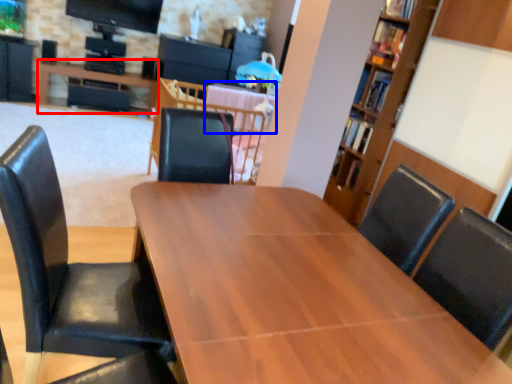
Question: Which of the following is the farthest to the observer, table (highlighted by a red box) or table (highlighted by a blue box)?

Choices:
 (A) table
 (B) table

Answer: (A)